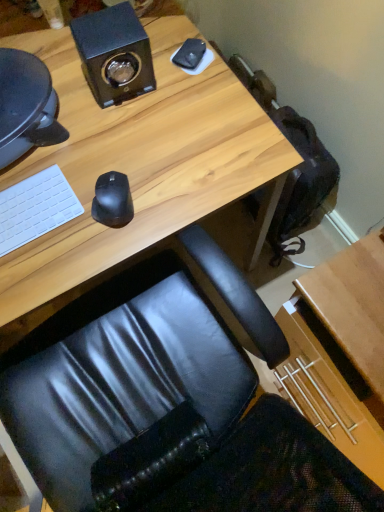
Question: Is black matte mouse at center taller or shorter than white matte keyboard at left?

Choices:
 (A) short
 (B) tall

Answer: (B)

Question: From the image's perspective, is black matte mouse at center above or below white matte keyboard at left?

Choices:
 (A) below
 (B) above

Answer: (B)

Question: Estimate the real-world distances between objects in this image. Which object is closer to the black leather chair at center?

Choices:
 (A) wooden desk at center
 (B) black matte speaker at upper left
 (C) black matte mouse at center
 (D) white matte keyboard at left

Answer: (A)

Question: Estimate the real-world distances between objects in this image. Which object is farther from the black leather chair at center?

Choices:
 (A) black matte speaker at upper left
 (B) wooden desk at center
 (C) white matte keyboard at left
 (D) black matte mouse at center

Answer: (A)